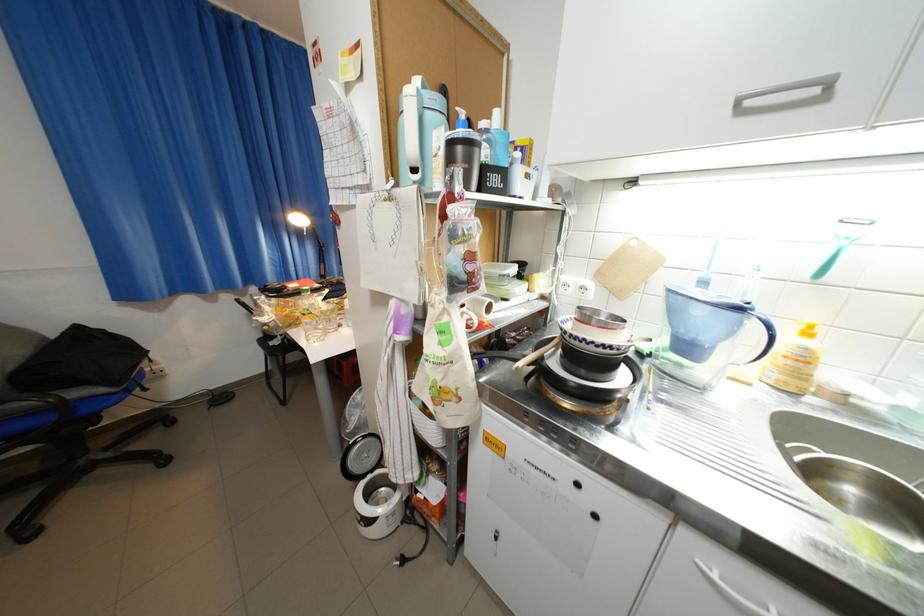
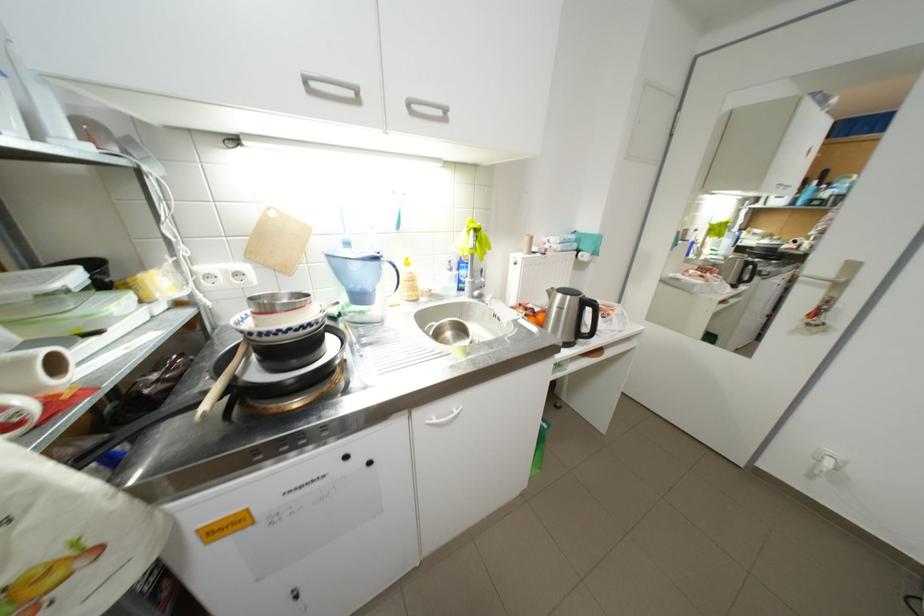
Find the pixel in the second image that matches point (751, 310) in the first image.

(387, 259)